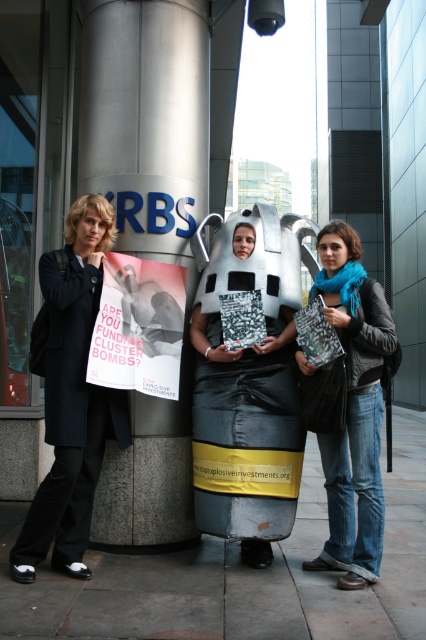
Question: Which object is closer to the camera taking this photo?

Choices:
 (A) blue scarf at center
 (B) brushed metal pillar at center
 (C) white paper poster at center
 (D) matte black coat at left

Answer: (D)

Question: Which point is closer to the camera?

Choices:
 (A) (31, 512)
 (B) (181, 145)
 (C) (325, 554)
 (D) (143, 387)

Answer: (A)

Question: Does brushed metal pillar at center appear on the left side of blue scarf at center?

Choices:
 (A) no
 (B) yes

Answer: (B)

Question: Which point is farther to the camera?

Choices:
 (A) brushed metal pillar at center
 (B) white paper poster at center
 (C) blue scarf at center
 (D) matte black coat at left

Answer: (A)

Question: Can you confirm if matte black coat at left is positioned below white paper poster at center?

Choices:
 (A) yes
 (B) no

Answer: (A)

Question: Is brushed metal pillar at center smaller than blue scarf at center?

Choices:
 (A) yes
 (B) no

Answer: (B)